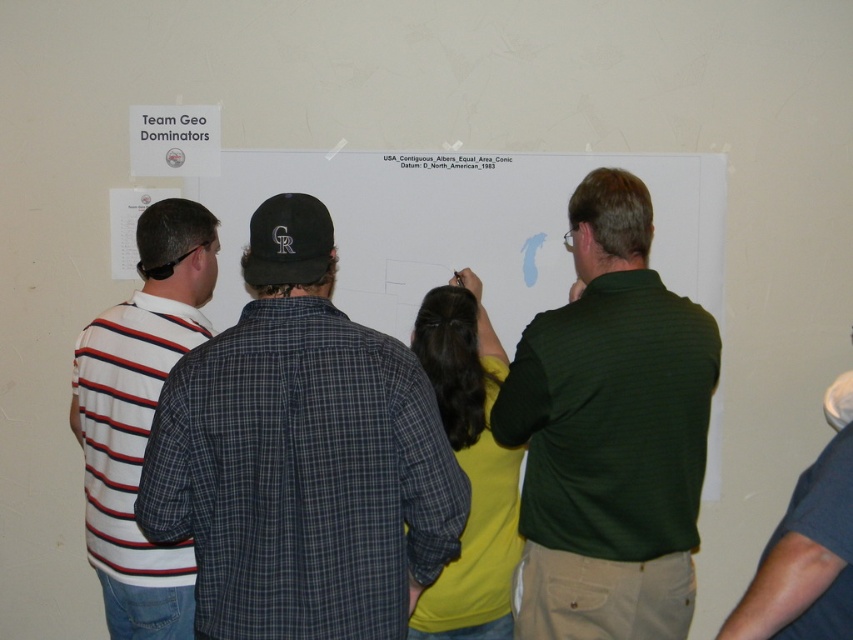
Is point (677, 232) more distant than point (459, 152)?

That is True.

Who is more forward, (689, 234) or (399, 154)?

Point (689, 234)

Is point (514, 273) farther from camera compared to point (432, 154)?

Yes, point (514, 273) is behind point (432, 154).

Locate an element on the screen. Image resolution: width=853 pixels, height=640 pixels. white paperboard at center is located at coordinates (465, 227).

Can you confirm if striped cotton shirt at left is bigger than white paperboard at center?

Actually, striped cotton shirt at left might be smaller than white paperboard at center.

Which is more to the right, striped cotton shirt at left or white paperboard at center?

From the viewer's perspective, white paperboard at center appears more on the right side.

Between point (404, 458) and point (695, 193), which one is positioned behind?

The point (695, 193) is behind.

Where is `striped cotton shirt at left`? striped cotton shirt at left is located at coordinates (300, 456).

Which of these two, striped cotton shirt at left or white paper at upper center, stands shorter?

white paper at upper center is shorter.

Who is taller, striped cotton shirt at left or white paper at upper center?

With more height is striped cotton shirt at left.

Measure the distance between striped cotton shirt at left and camera.

They are 1.65 meters apart.

Find the location of a particular element. striped cotton shirt at left is located at coordinates (300, 456).